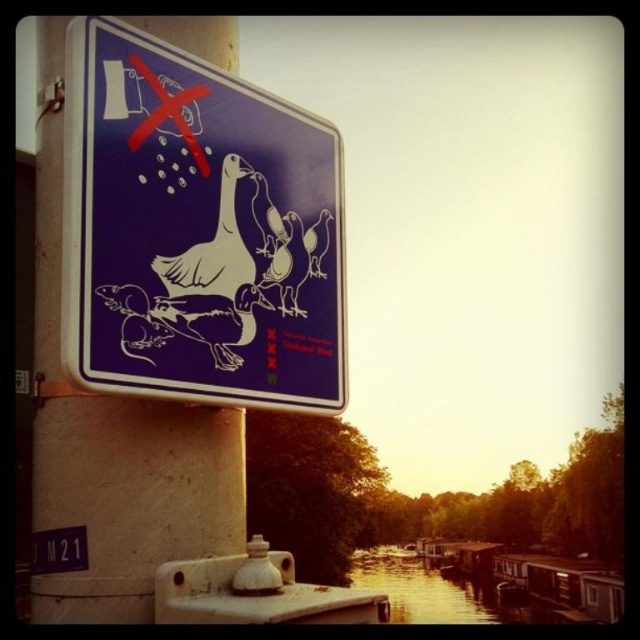
Between matte blue sign at upper left and blue plastic sign at upper left, which one is positioned higher?

matte blue sign at upper left

Between point (92, 92) and point (45, 572), which one is positioned behind?

The point (45, 572) is behind.

Locate an element on the screen. This screenshot has width=640, height=640. matte blue sign at upper left is located at coordinates (196, 230).

Measure the distance from matte blue sign at upper left to metallic pole at left.

matte blue sign at upper left and metallic pole at left are 18.40 centimeters apart.

You are a GUI agent. You are given a task and a screenshot of the screen. Output one action in this format:
    pyautogui.click(x=<x>, y=<y>)
    Task: Click on the matte blue sign at upper left
    The image size is (640, 640).
    Given the screenshot: What is the action you would take?
    pyautogui.click(x=196, y=230)

Locate an element on the screen. Image resolution: width=640 pixels, height=640 pixels. matte blue sign at upper left is located at coordinates (196, 230).

Is metallic pole at left further to camera compared to blue plastic sign at upper left?

No, it is not.

Between metallic pole at left and blue plastic sign at upper left, which one has less height?

blue plastic sign at upper left

Identify the location of metallic pole at left. The width and height of the screenshot is (640, 640). (120, 458).